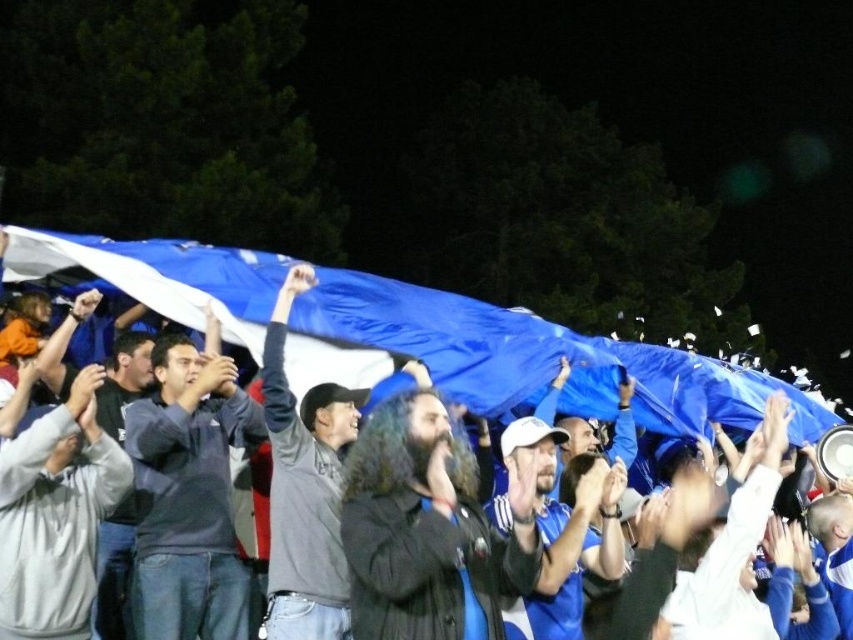
Which is above, blue fabric flag at upper center or dark brown leather jacket at center?

blue fabric flag at upper center

Is blue fabric flag at upper center to the left of dark brown leather jacket at center from the viewer's perspective?

No, blue fabric flag at upper center is not to the left of dark brown leather jacket at center.

Is point (341, 305) farther from camera compared to point (386, 513)?

Yes, it is.

Find the location of `blue fabric flag at upper center`. blue fabric flag at upper center is located at coordinates (519, 358).

Does gray fleece sweatshirt at center come in front of dark gray sweater at center?

That is True.

Based on the photo, is gray fleece sweatshirt at center smaller than dark gray sweater at center?

Yes, gray fleece sweatshirt at center is smaller than dark gray sweater at center.

Which is in front, point (36, 506) or point (281, 541)?

Point (36, 506) is more forward.

Image resolution: width=853 pixels, height=640 pixels. Identify the location of gray fleece sweatshirt at center. (56, 515).

Is blue fabric flag at upper center further to the viewer compared to dark gray sweater at center?

Yes.

The image size is (853, 640). Find the location of `blue fabric flag at upper center`. blue fabric flag at upper center is located at coordinates (519, 358).

The width and height of the screenshot is (853, 640). Find the location of `blue fabric flag at upper center`. blue fabric flag at upper center is located at coordinates (519, 358).